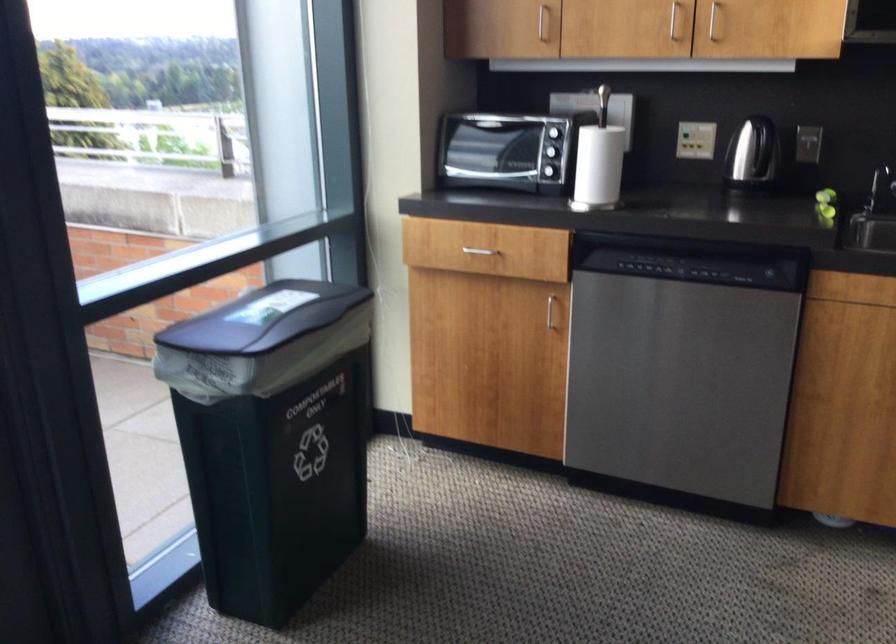
Find the location of `black trash can lid`. black trash can lid is located at coordinates coord(262,319).